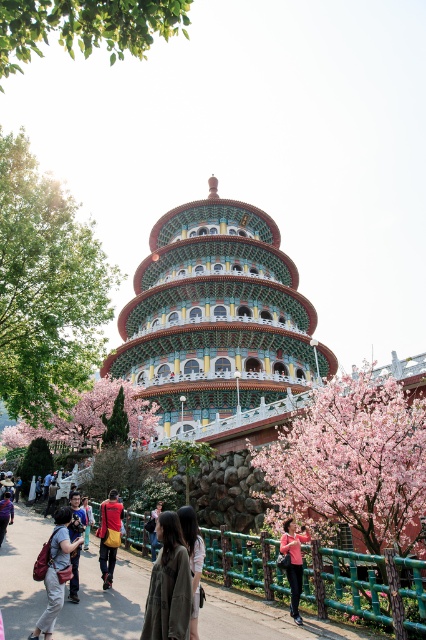
Question: Which of the following is the closest to the observer?

Choices:
 (A) (63, 436)
 (B) (120, 422)
 (C) (181, 560)
 (D) (77, 513)

Answer: (C)

Question: Is green wooden fence at lower center positioned before matte black backpack at lower center?

Choices:
 (A) yes
 (B) no

Answer: (B)

Question: Among these points, which one is nearest to the camera?

Choices:
 (A) (245, 595)
 (B) (141, 403)
 (C) (69, 586)

Answer: (C)

Question: Is red fabric backpack at center smaller than matte black camera at lower left?

Choices:
 (A) yes
 (B) no

Answer: (A)

Question: Which object is farther from the camera taking this photo?

Choices:
 (A) pink fabric at lower center
 (B) green textured tree at lower left
 (C) purple fabric bag at center

Answer: (B)

Question: Is matte black backpack at lower center wider than dark gray fabric jacket at center?

Choices:
 (A) no
 (B) yes

Answer: (B)